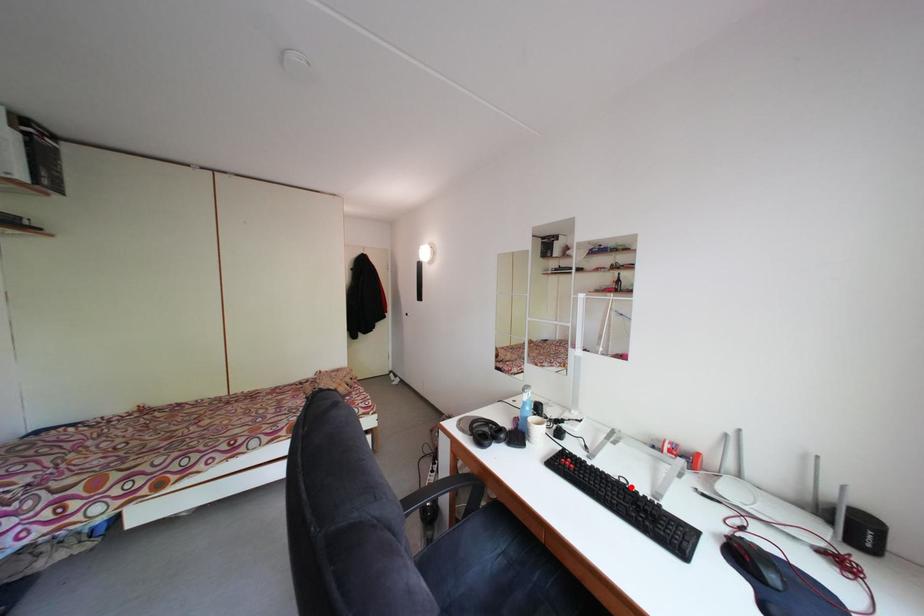
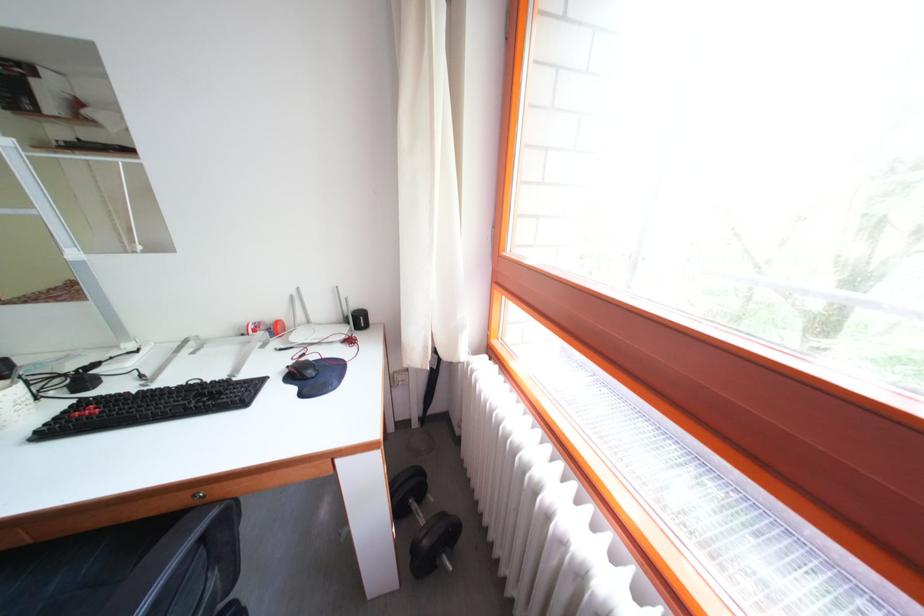
Locate, in the second image, the point that corresponds to the highlighted location in the first image.

(201, 389)